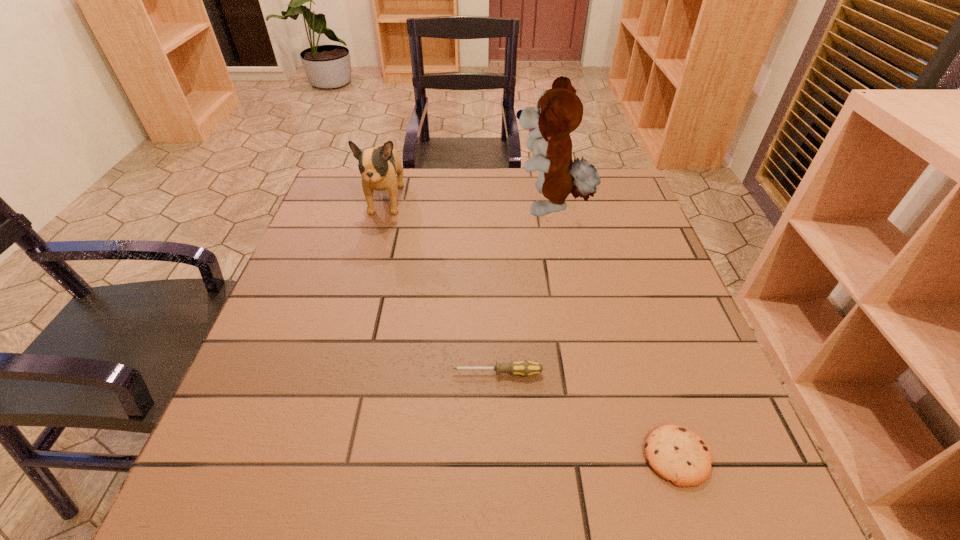
Locate an element on the screen. unoccupied area between the shorter puppy and the taller puppy is located at coordinates (468, 204).

Image resolution: width=960 pixels, height=540 pixels. What are the coordinates of `free space between the shorter puppy and the screwdriver` in the screenshot? It's located at (442, 287).

Locate an element on the screen. free space between the cookie and the shorter puppy is located at coordinates (531, 328).

Where is `free space between the right puppy and the nearest object`? This screenshot has width=960, height=540. free space between the right puppy and the nearest object is located at coordinates (613, 332).

The height and width of the screenshot is (540, 960). Identify the location of free space between the cookie and the right puppy. (613, 332).

This screenshot has width=960, height=540. I want to click on free space between the left puppy and the nearest object, so (x=531, y=328).

Where is `the closest object relative to the third shortest object`? This screenshot has width=960, height=540. the closest object relative to the third shortest object is located at coordinates (559, 111).

At what (x,y) coordinates should I click in order to perform the action: click on object that ranks as the closest to the shorter puppy. Please return your answer as a coordinate pair (x, y). Looking at the image, I should click on (559, 111).

Find the location of `blank area in the image that satisfies the following two spatial constraints: 1. at the face of the nearest object; 2. on the left side of the shorter puppy`. blank area in the image that satisfies the following two spatial constraints: 1. at the face of the nearest object; 2. on the left side of the shorter puppy is located at coordinates (318, 456).

The width and height of the screenshot is (960, 540). What are the coordinates of `vacant space that satisfies the following two spatial constraints: 1. on the face of the taller puppy; 2. on the right side of the cookie` in the screenshot? It's located at [x=600, y=456].